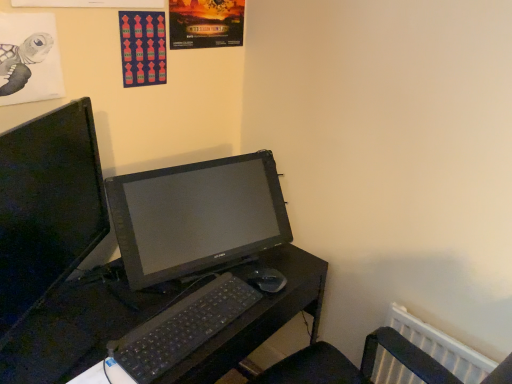
Locate an element on the screen. vacant region above black plastic desk at center (from a real-world perspective) is located at coordinates [x=156, y=308].